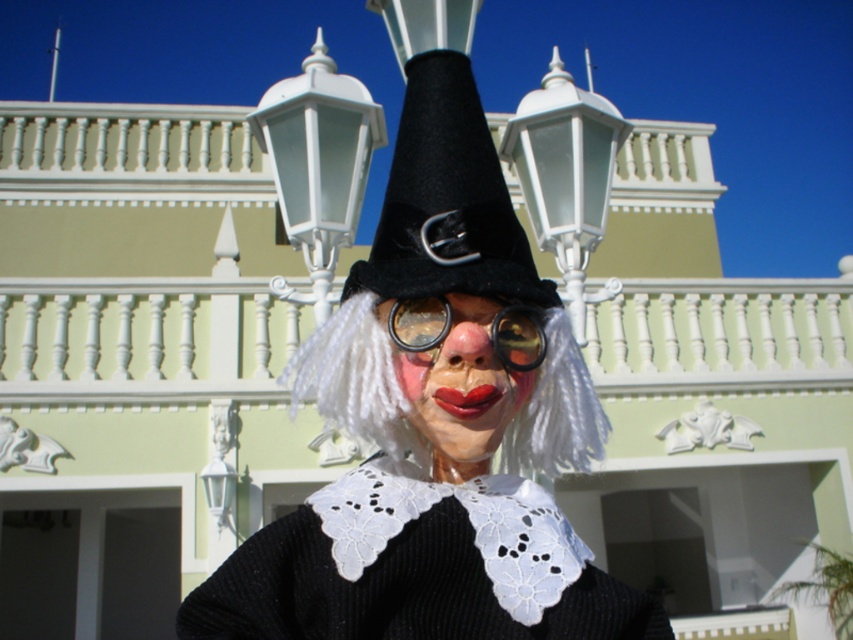
You are standing in front of the building with the light green facade and need to locate both the white glossy streetlight at upper center and the matte plastic clown face at center. Which object is positioned to the left of the other?

The white glossy streetlight at upper center is to the left of the matte plastic clown face at center.

You are standing in front of the building with the light green facade and need to place a decorative item exactly at the coordinates provided in the image. Where should you position the matte black witch hat at center?

The matte black witch hat at center should be positioned at point (434, 433) as specified in the description.

You are a costume designer preparing for a Halloween party. You have two hats in front of you, the matte black witch hat at center and the black felt hat at center. Which hat has a wider brim?

The matte black witch hat at center has a wider brim than the black felt hat at center.